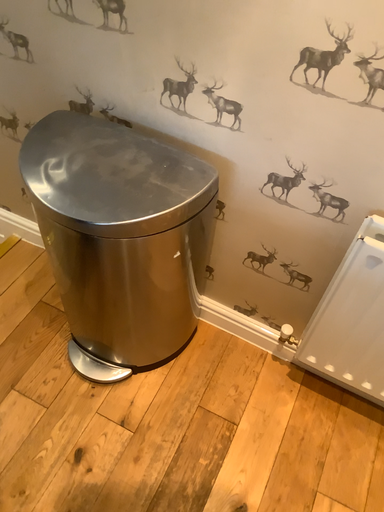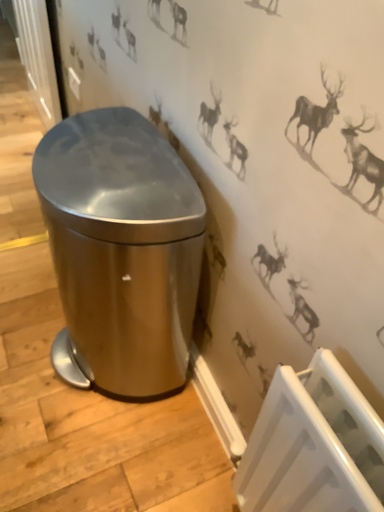
Question: Which way did the camera rotate in the video?

Choices:
 (A) rotated right
 (B) rotated left

Answer: (B)